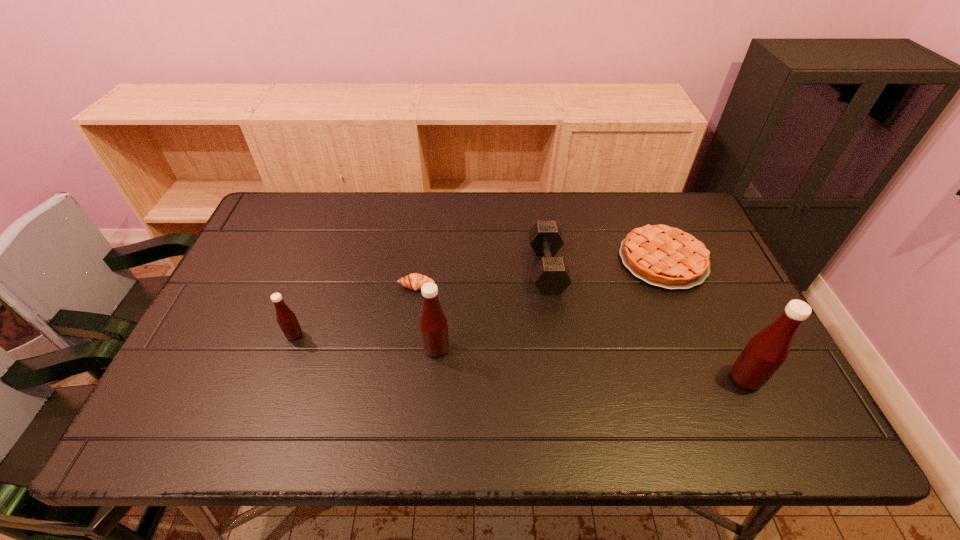
Where is `vacant region between the second shortest Tabasco sauce and the rightmost Tabasco sauce`? The width and height of the screenshot is (960, 540). vacant region between the second shortest Tabasco sauce and the rightmost Tabasco sauce is located at coordinates (590, 364).

Identify the location of blank region between the pie and the dumbbell. This screenshot has width=960, height=540. (605, 264).

You are a GUI agent. You are given a task and a screenshot of the screen. Output one action in this format:
    pyautogui.click(x=<x>, y=<y>)
    Task: Click on the free space between the pie and the fifth shortest object
    The width and height of the screenshot is (960, 540).
    Given the screenshot: What is the action you would take?
    pyautogui.click(x=550, y=305)

Identify the location of empty space between the leftmost object and the fifth tallest object. This screenshot has width=960, height=540. (479, 298).

This screenshot has width=960, height=540. I want to click on free point between the leftmost object and the fifth tallest object, so click(479, 298).

I want to click on object identified as the second closest to the second shortest object, so click(x=766, y=351).

Where is `the fourth closest object relative to the leftmost Tabasco sauce`? the fourth closest object relative to the leftmost Tabasco sauce is located at coordinates (663, 256).

Identify the location of Tabasco sauce that is the third closest to the pie. The width and height of the screenshot is (960, 540). (286, 318).

Identify the location of the second closest Tabasco sauce to the fourth object from left to right. Image resolution: width=960 pixels, height=540 pixels. (766, 351).

At what (x,y) coordinates should I click in order to perform the action: click on vacant point that satisfies the following two spatial constraints: 1. on the front-facing side of the second tallest Tabasco sauce; 2. on the left side of the shortest object. Please return your answer as a coordinate pair (x, y). Looking at the image, I should click on [408, 349].